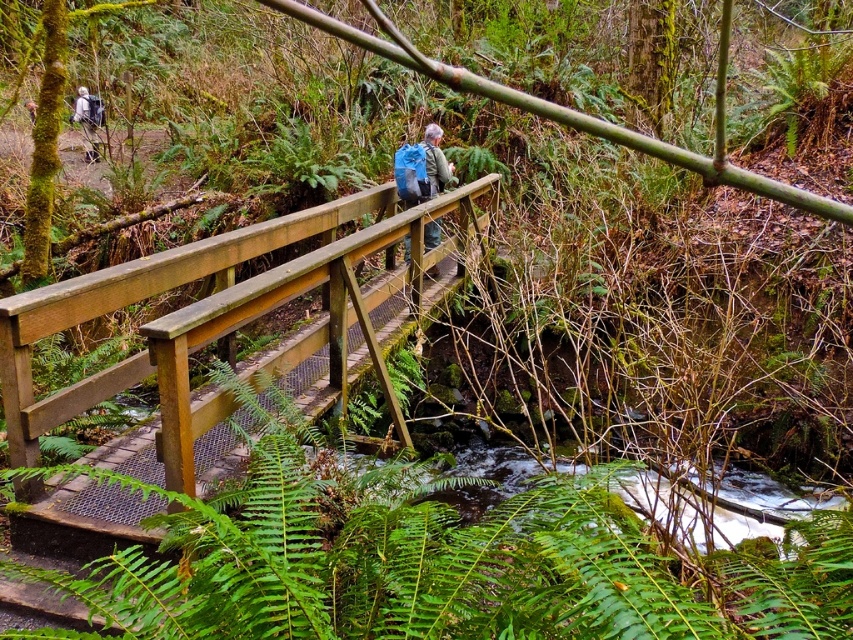
You are a hiker who wants to cross the wooden bridge safely. You notice a green leafy fern at center and a wooden rail at center. Which object should you avoid stepping on to stay on the bridge?

You should avoid stepping on the green leafy fern at center because it is positioned on the right side of the wooden rail at center, meaning it is likely growing off the bridge and onto the ground. The wooden rail at center is part of the bridge structure and safe to hold onto for balance.

You are a hiker carrying a blue backpack at center and need to reach the wooden bridge to cross the stream. The green leafy fern at center is blocking your path. Can you walk around it without getting too close? The bridge is narrow and only allows one person at a time.

The distance between the green leafy fern at center and the blue backpack at center is 5.96 meters. Since the bridge is narrow and only allows one person at a time, you can safely walk around the fern while maintaining a distance of nearly 6 meters, ensuring there is enough space to navigate without obstruction.